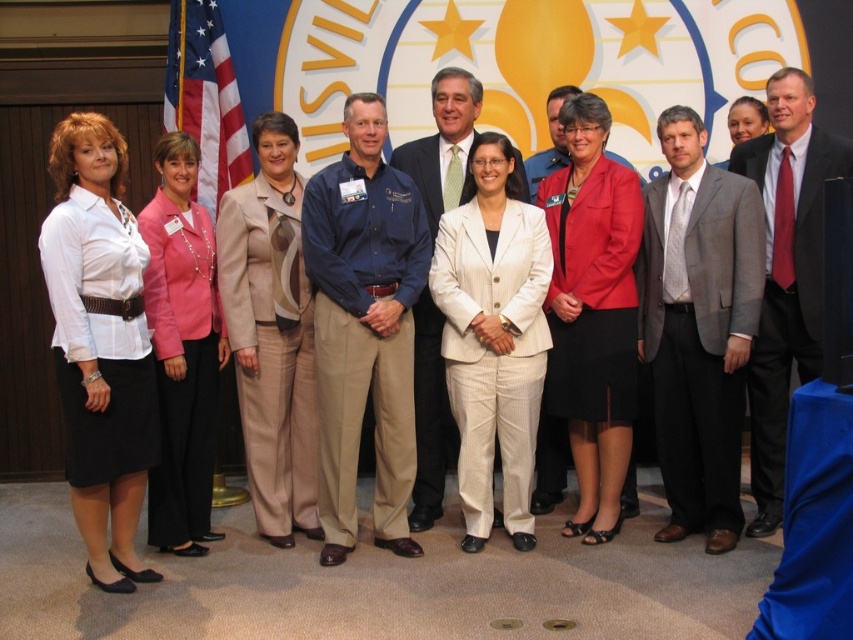
Is gray fabric suit at center to the right of matte red blazer at center from the viewer's perspective?

Yes, gray fabric suit at center is to the right of matte red blazer at center.

Between point (685, 305) and point (610, 236), which one is positioned in front?

Point (685, 305) is more forward.

Measure the distance between point [730,358] and camera.

A distance of 4.33 meters exists between point [730,358] and camera.

Image resolution: width=853 pixels, height=640 pixels. In order to click on gray fabric suit at center in this screenshot , I will do `click(698, 326)`.

Who is taller, dark gray suit at right or american flag at left?

With more height is dark gray suit at right.

How distant is dark gray suit at right from american flag at left?

dark gray suit at right and american flag at left are 11.57 feet apart.

This screenshot has width=853, height=640. What are the coordinates of `dark gray suit at right` in the screenshot? It's located at (786, 273).

Is blue cotton shirt at center below white satin blouse at center?

No.

Between blue cotton shirt at center and white satin blouse at center, which one appears on the left side from the viewer's perspective?

From the viewer's perspective, white satin blouse at center appears more on the left side.

Does point (376, 157) lie in front of point (119, 403)?

No, it is behind (119, 403).

You are a GUI agent. You are given a task and a screenshot of the screen. Output one action in this format:
    pyautogui.click(x=<x>, y=<y>)
    Task: Click on the blue cotton shirt at center
    
    Given the screenshot: What is the action you would take?
    pyautogui.click(x=364, y=326)